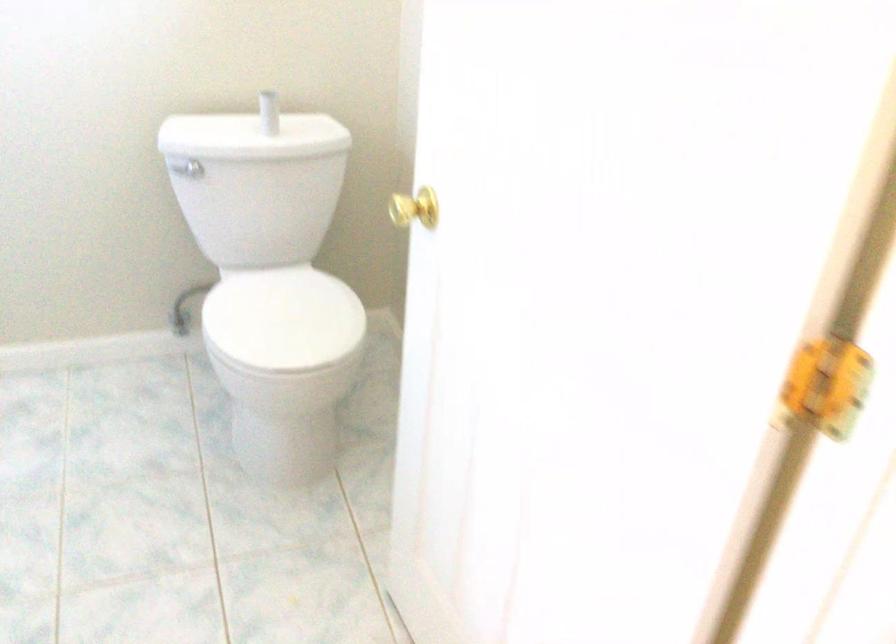
Where would you turn the gold doorknob? Please return your answer as a coordinate pair (x, y).

(415, 207)